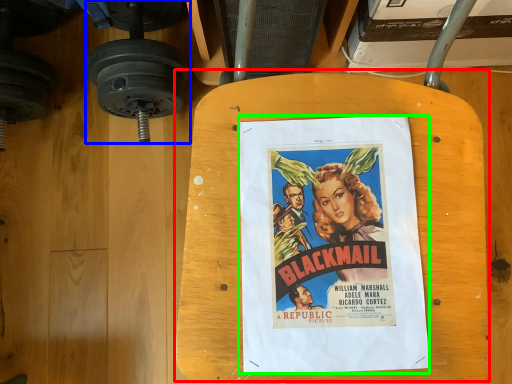
Question: Based on their relative distances, which object is farther from table (highlighted by a red box)? Choose from dumbbell (highlighted by a blue box) and poster (highlighted by a green box).

Choices:
 (A) dumbbell
 (B) poster

Answer: (A)